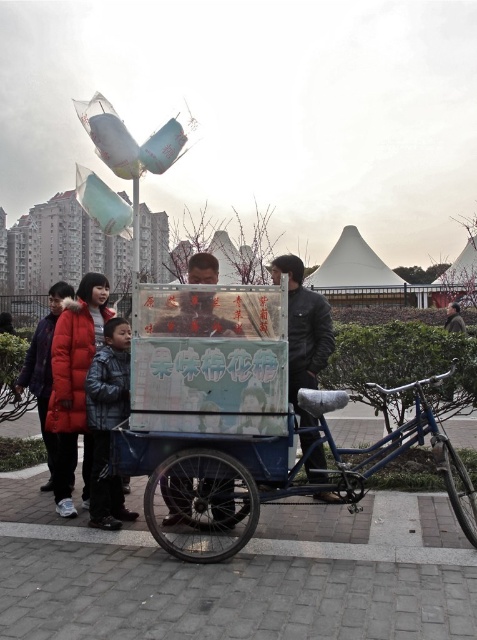
Question: Which of the following is the closest to the observer?

Choices:
 (A) (105, 483)
 (B) (223, 451)

Answer: (B)

Question: Does blue metallic bicycle at center have a lesser width compared to dark gray jacket at lower left?

Choices:
 (A) yes
 (B) no

Answer: (B)

Question: Can you confirm if dark gray jacket at lower left is positioned below metallic cart at center?

Choices:
 (A) no
 (B) yes

Answer: (A)

Question: Among these objects, which one is nearest to the camera?

Choices:
 (A) metallic cart at center
 (B) black leather jacket at center

Answer: (A)

Question: Which of the following is the farthest from the observer?

Choices:
 (A) metallic cart at center
 (B) dark gray jacket at lower left

Answer: (B)

Question: Can you confirm if blue metallic bicycle at center is wider than dark gray jacket at lower left?

Choices:
 (A) no
 (B) yes

Answer: (B)